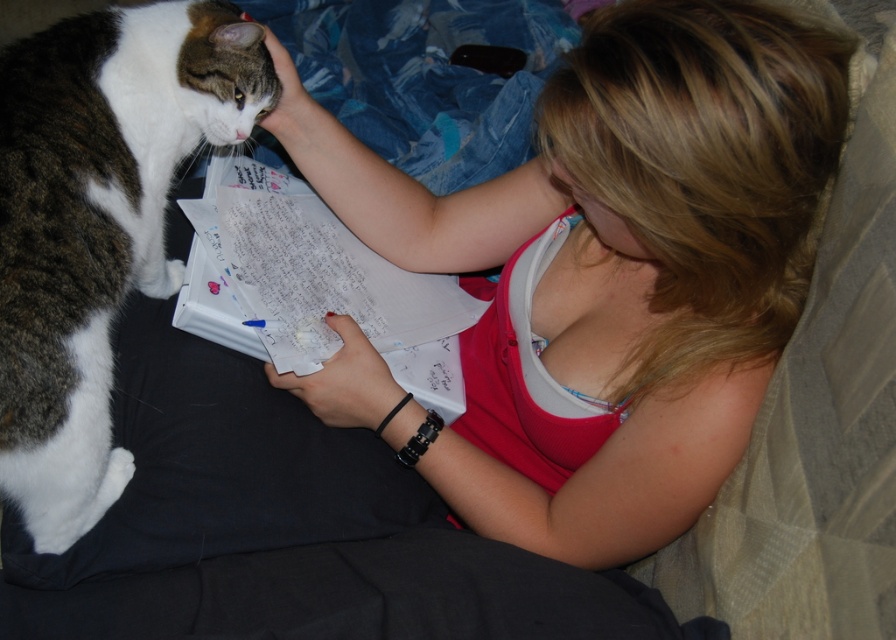
You are a photographer trying to capture a clear shot of the tabby fur cat at left without the matte pink tank top at center blocking the view. Based on their positions, is this possible?

The matte pink tank top at center is in front of the tabby fur cat at left, so it would block the view of the cat. To capture a clear shot of the tabby fur cat at left without obstruction, you need to adjust your angle or position so that the tank top is not between you and the cat.

From the picture: You are a photographer trying to capture the scene where the matte pink tank top at center and the tabby fur cat at left are both clearly visible. Based on their positions, which object is closer to the camera?

The tabby fur cat at left is closer to the camera because the matte pink tank top at center is above it, indicating it is positioned higher and possibly further back.

What is the exact coordinate of the matte pink tank top at center in the image?

The matte pink tank top at center is located at point (605, 269).